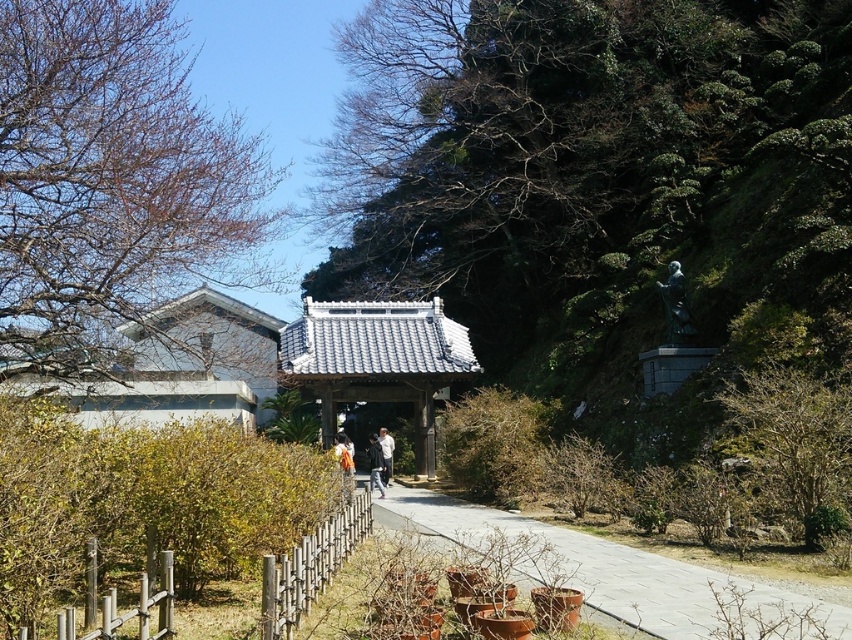
Does point (383, 467) come closer to viewer compared to point (383, 458)?

Yes, point (383, 467) is in front of point (383, 458).

Who is lower down, dark gray jacket at center or white matte person at center?

dark gray jacket at center is lower down.

Identify the location of dark gray jacket at center. Image resolution: width=852 pixels, height=640 pixels. (x=375, y=465).

The image size is (852, 640). Find the location of `dark gray jacket at center`. dark gray jacket at center is located at coordinates (375, 465).

Which of these two, smooth concrete path at center or orange fabric at center, stands taller?

Standing taller between the two is smooth concrete path at center.

Does point (424, 496) come behind point (346, 436)?

No, it is not.

Identify the location of smooth concrete path at center. 613,570.

Can you confirm if wooden fence at lower center is positioned to the right of white matte person at center?

Indeed, wooden fence at lower center is positioned on the right side of white matte person at center.

Identify the location of wooden fence at lower center. This screenshot has width=852, height=640. (309, 566).

Where is `wooden fence at lower center`? wooden fence at lower center is located at coordinates (309, 566).

In order to click on wooden fence at lower center in this screenshot , I will do `click(309, 566)`.